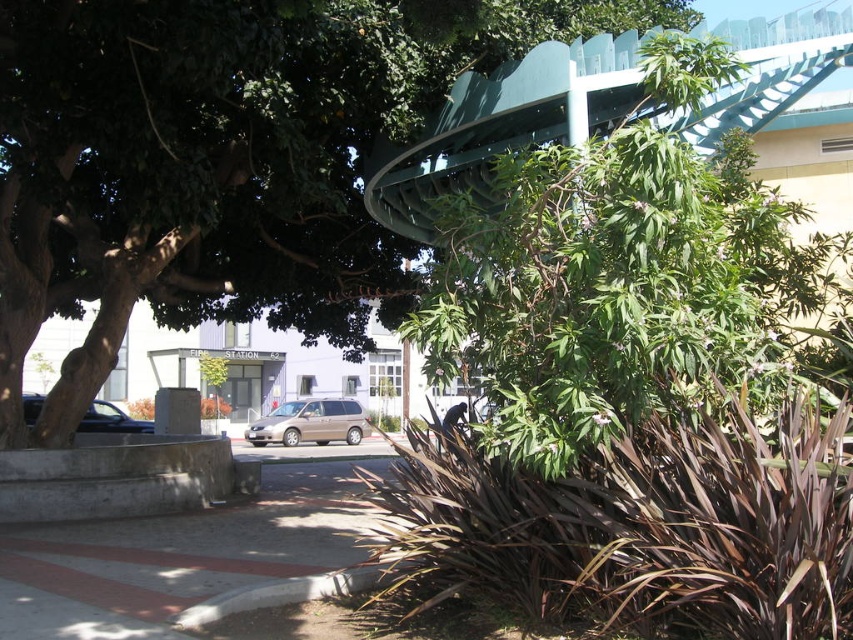
Is green leafy tree at upper center below shiny black sedan at left?

No.

Where is `green leafy tree at upper center`? This screenshot has height=640, width=853. green leafy tree at upper center is located at coordinates (223, 160).

Identify the location of green leafy tree at upper center. Image resolution: width=853 pixels, height=640 pixels. (223, 160).

Can you confirm if green leafy tree at upper center is taller than concrete at lower left?

Correct, green leafy tree at upper center is much taller as concrete at lower left.

Between green leafy tree at upper center and concrete at lower left, which one is positioned higher?

Positioned higher is green leafy tree at upper center.

Is point (154, 65) positioned before point (125, 618)?

No, it is not.

Identify the location of green leafy tree at upper center. The image size is (853, 640). (223, 160).

Does green leafy tree at upper center have a greater height compared to gray concrete curb at lower center?

Yes.

Can you confirm if green leafy tree at upper center is smaller than gray concrete curb at lower center?

Incorrect, green leafy tree at upper center is not smaller in size than gray concrete curb at lower center.

Does point (94, 234) come closer to viewer compared to point (344, 576)?

That is False.

You are a GUI agent. You are given a task and a screenshot of the screen. Output one action in this format:
    pyautogui.click(x=<x>, y=<y>)
    Task: Click on the green leafy tree at upper center
    This screenshot has width=853, height=640.
    Given the screenshot: What is the action you would take?
    pyautogui.click(x=223, y=160)